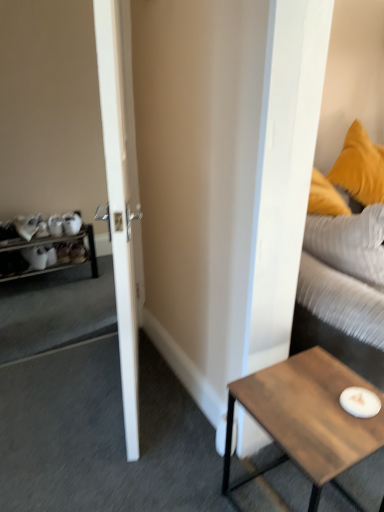
Question: Considering the relative sizes of wooden coffee table at lower right and wooden shelf at left in the image provided, is wooden coffee table at lower right bigger than wooden shelf at left?

Choices:
 (A) no
 (B) yes

Answer: (A)

Question: From the image's perspective, is wooden coffee table at lower right on wooden shelf at left?

Choices:
 (A) no
 (B) yes

Answer: (A)

Question: Does wooden coffee table at lower right touch wooden shelf at left?

Choices:
 (A) yes
 (B) no

Answer: (B)

Question: Would you say wooden coffee table at lower right is outside wooden shelf at left?

Choices:
 (A) yes
 (B) no

Answer: (A)

Question: From a real-world perspective, is wooden coffee table at lower right positioned under wooden shelf at left based on gravity?

Choices:
 (A) yes
 (B) no

Answer: (B)

Question: From a real-world perspective, is wooden shelf at left positioned above or below wooden coffee table at lower right?

Choices:
 (A) above
 (B) below

Answer: (B)

Question: Considering the positions of wooden shelf at left and wooden coffee table at lower right in the image, is wooden shelf at left taller or shorter than wooden coffee table at lower right?

Choices:
 (A) short
 (B) tall

Answer: (A)

Question: Does point (33, 247) appear closer or farther from the camera than point (317, 452)?

Choices:
 (A) closer
 (B) farther

Answer: (B)

Question: In the image, is wooden shelf at left positioned in front of or behind wooden coffee table at lower right?

Choices:
 (A) front
 (B) behind

Answer: (B)

Question: From the image's perspective, is wooden shelf at left above or below white glossy door at left?

Choices:
 (A) above
 (B) below

Answer: (B)

Question: Relative to white glossy door at left, is wooden shelf at left in front or behind?

Choices:
 (A) behind
 (B) front

Answer: (A)

Question: From a real-world perspective, relative to white glossy door at left, is wooden shelf at left vertically above or below?

Choices:
 (A) above
 (B) below

Answer: (B)

Question: Considering the relative positions of wooden shelf at left and white glossy door at left in the image provided, is wooden shelf at left to the left or to the right of white glossy door at left?

Choices:
 (A) right
 (B) left

Answer: (B)

Question: From a real-world perspective, is white glossy door at left positioned above or below wooden shelf at left?

Choices:
 (A) above
 (B) below

Answer: (A)

Question: From the image's perspective, relative to wooden shelf at left, is white glossy door at left above or below?

Choices:
 (A) below
 (B) above

Answer: (B)